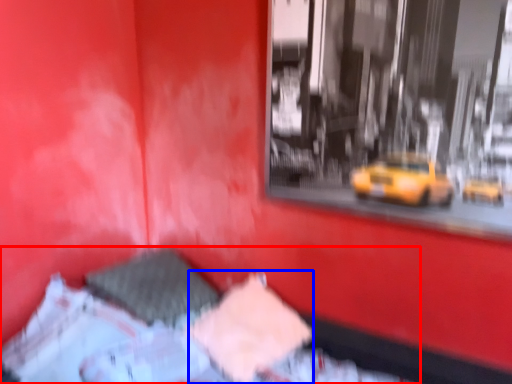
Question: Among these objects, which one is farthest to the camera, bed (highlighted by a red box) or sheet (highlighted by a blue box)?

Choices:
 (A) bed
 (B) sheet

Answer: (B)